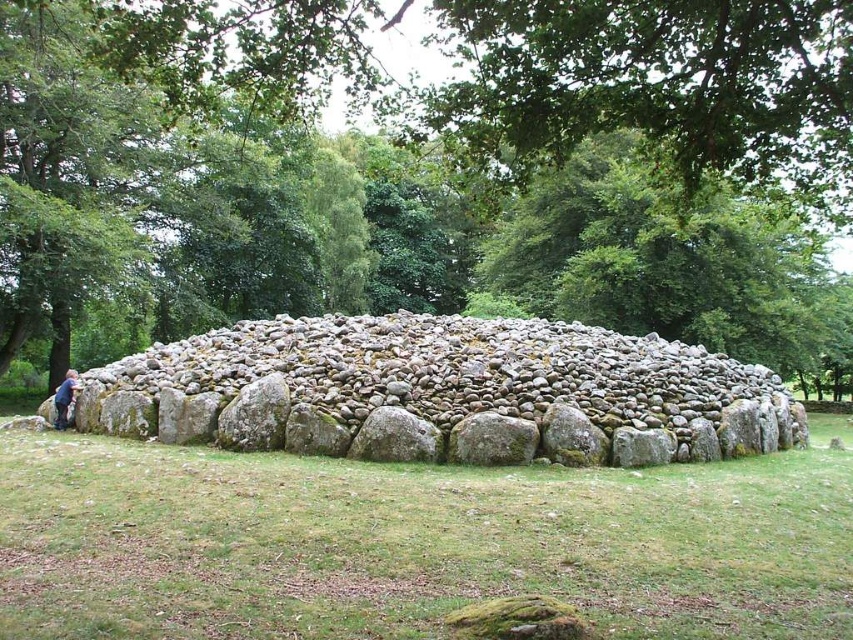
Question: Which point appears closest to the camera in this image?

Choices:
 (A) (68, 371)
 (B) (622, 432)
 (C) (177, 616)
 (D) (10, 326)

Answer: (C)

Question: Is green leafy tree at center positioned behind smooth gray rock at center?

Choices:
 (A) no
 (B) yes

Answer: (A)

Question: Is the position of smooth gray rock at center more distant than that of dark brown leather jacket at lower left?

Choices:
 (A) yes
 (B) no

Answer: (B)

Question: Which point appears closest to the camera in this image?

Choices:
 (A) (64, 394)
 (B) (589, 378)

Answer: (B)

Question: Estimate the real-world distances between objects in this image. Which object is farther from the smooth gray rock at center?

Choices:
 (A) green grass at lower center
 (B) dark brown leather jacket at lower left
 (C) green leafy tree at center

Answer: (C)

Question: Does green grass at lower center have a lesser width compared to smooth gray rock at center?

Choices:
 (A) no
 (B) yes

Answer: (B)